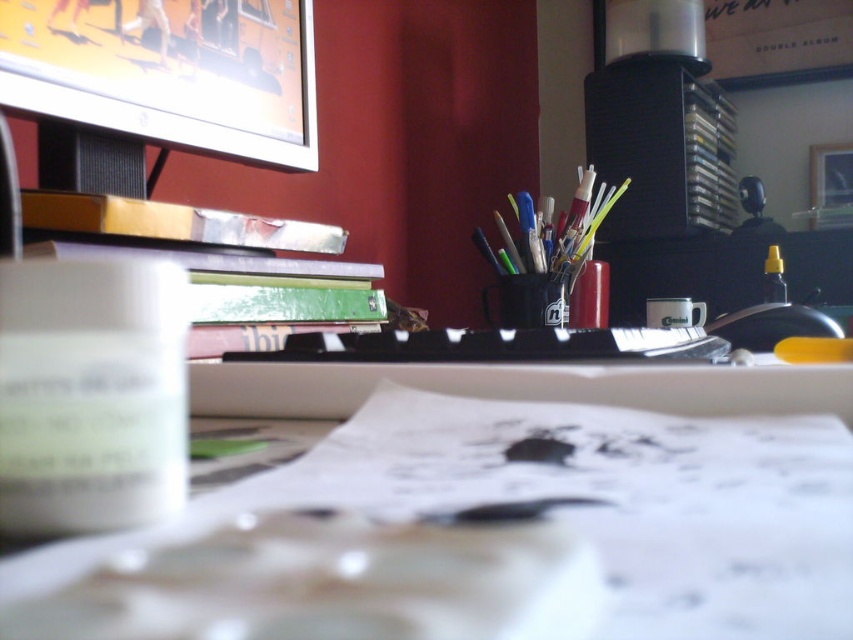
Is matte silver monitor at upper left thinner than metallic silver stapler at center?

Incorrect, matte silver monitor at upper left's width is not less than metallic silver stapler at center's.

Is the position of matte silver monitor at upper left more distant than that of metallic silver stapler at center?

No, matte silver monitor at upper left is closer to the viewer.

The image size is (853, 640). Identify the location of matte silver monitor at upper left. (169, 72).

Is white matte jar at lower left wider than yellow translucent bottle at right?

In fact, white matte jar at lower left might be narrower than yellow translucent bottle at right.

The width and height of the screenshot is (853, 640). I want to click on white matte jar at lower left, so click(90, 394).

In the scene shown: Can you confirm if white matte jar at lower left is positioned to the left of metallic silver stapler at center?

Yes, white matte jar at lower left is to the left of metallic silver stapler at center.

This screenshot has height=640, width=853. What do you see at coordinates (90, 394) in the screenshot?
I see `white matte jar at lower left` at bounding box center [90, 394].

Locate an element on the screen. This screenshot has width=853, height=640. white matte jar at lower left is located at coordinates (90, 394).